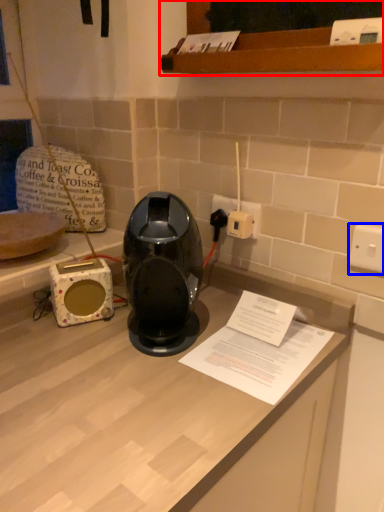
Question: Which object is further to the camera taking this photo, cabinetry (highlighted by a red box) or electric outlet (highlighted by a blue box)?

Choices:
 (A) cabinetry
 (B) electric outlet

Answer: (B)